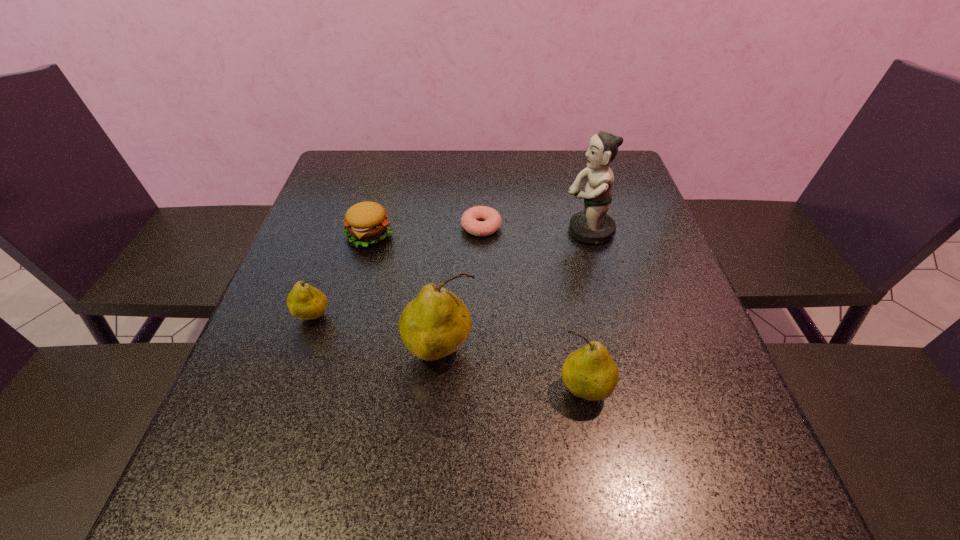
Identify the location of free point located on the right of the tallest pear. The height and width of the screenshot is (540, 960). (522, 351).

The width and height of the screenshot is (960, 540). I want to click on free region located on the left of the rightmost pear, so click(x=408, y=390).

The image size is (960, 540). What are the coordinates of `vacant space located 0.110m on the front-facing side of the figurine` in the screenshot? It's located at (517, 231).

Locate an element on the screen. vacant space located 0.080m on the front-facing side of the figurine is located at coordinates (530, 231).

This screenshot has width=960, height=540. What are the coordinates of `free region located on the front-facing side of the figurine` in the screenshot? It's located at pyautogui.click(x=411, y=231).

This screenshot has width=960, height=540. Find the location of `free space located on the front of the second shortest object`. free space located on the front of the second shortest object is located at coordinates (339, 347).

Find the location of a particular element. blank space located 0.280m on the left of the doughnut is located at coordinates point(351,227).

The width and height of the screenshot is (960, 540). What are the coordinates of `object located at the near edge` in the screenshot? It's located at (590, 373).

You are a GUI agent. You are given a task and a screenshot of the screen. Output one action in this format:
    pyautogui.click(x=<x>, y=<y>)
    Task: Click on the pear located at the left edge
    The image size is (960, 540).
    Given the screenshot: What is the action you would take?
    pyautogui.click(x=304, y=302)

In order to click on hamburger located in the left edge section of the desktop in this screenshot , I will do `click(366, 223)`.